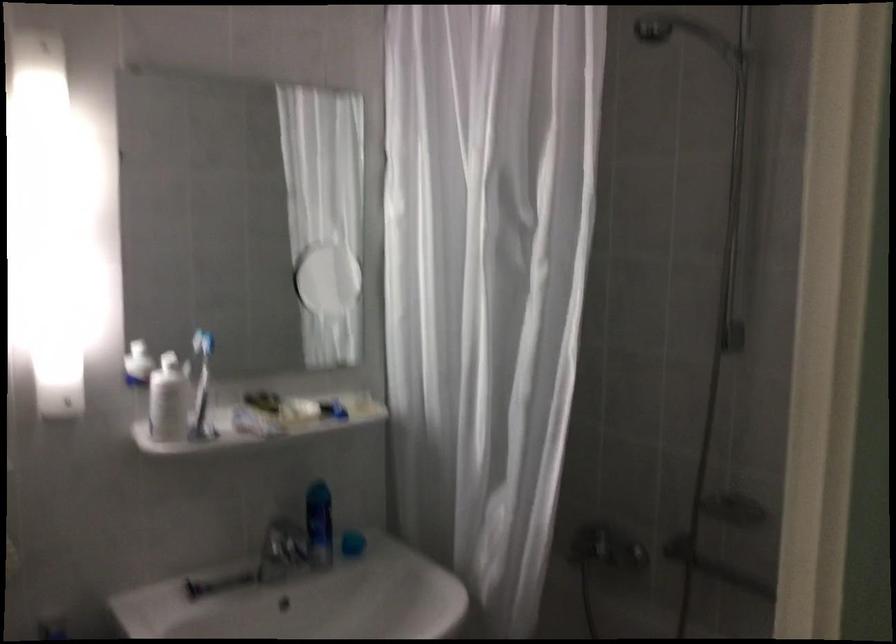
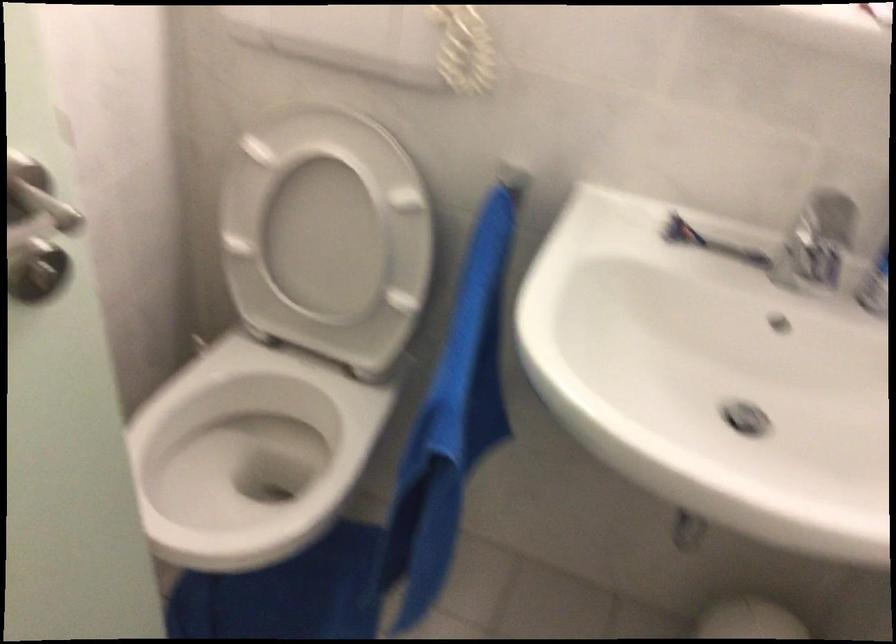
The first image is from the beginning of the video and the second image is from the end. How did the camera likely rotate when shooting the video?

The rotation direction of the camera is left-down.